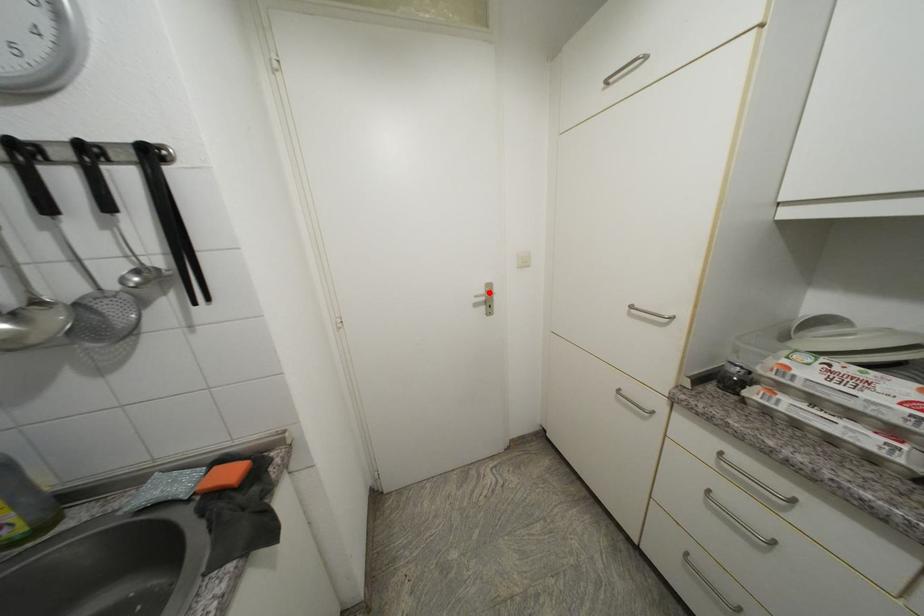
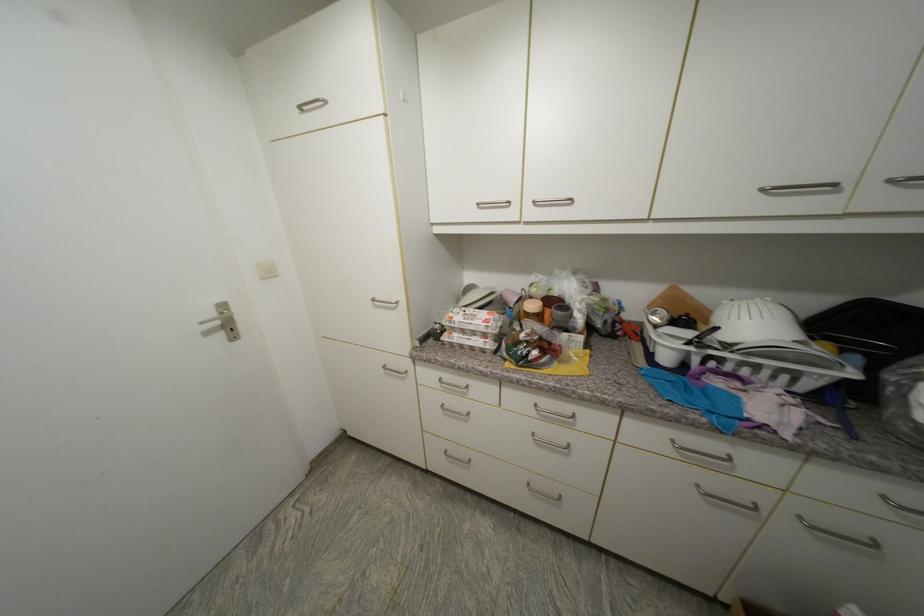
Where in the second image is the point corresponding to the highlighted location from the first image?

(220, 315)